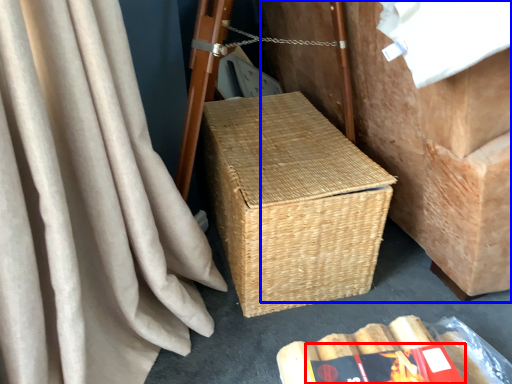
Question: Which point is further to the camera, paperback book (highlighted by a red box) or furniture (highlighted by a blue box)?

Choices:
 (A) paperback book
 (B) furniture

Answer: (A)